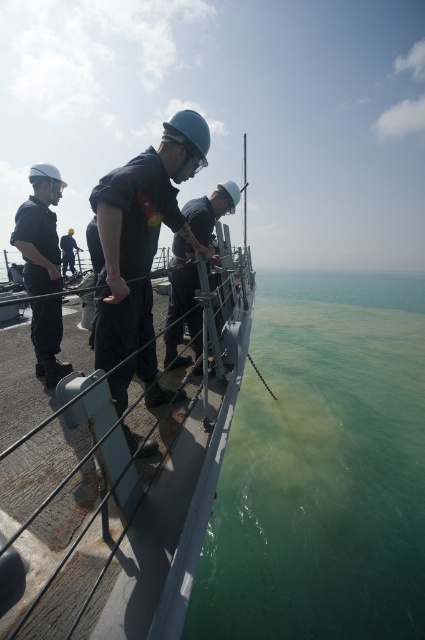
Does metallic gray helmet at center have a lesser height compared to dark blue uniform at center?

In fact, metallic gray helmet at center may be taller than dark blue uniform at center.

Describe the element at coordinates (184, 291) in the screenshot. This screenshot has height=640, width=425. I see `metallic gray helmet at center` at that location.

Is point (198, 317) positioned in front of point (64, 252)?

Yes, point (198, 317) is in front of point (64, 252).

Where is `metallic gray helmet at center`? This screenshot has height=640, width=425. metallic gray helmet at center is located at coordinates (184, 291).

Does black matte helmet at center have a greater height compared to matte black uniform at left?

In fact, black matte helmet at center may be shorter than matte black uniform at left.

This screenshot has width=425, height=640. I want to click on black matte helmet at center, so click(141, 250).

Does point (115, 336) come behind point (51, 262)?

No, it is in front of (51, 262).

At what (x,y) coordinates should I click in order to perform the action: click on black matte helmet at center. Please return your answer as a coordinate pair (x, y). The width and height of the screenshot is (425, 640). Looking at the image, I should click on (141, 250).

Who is taller, metallic gray boat at center or dark blue uniform at center?

With more height is dark blue uniform at center.

Consider the image. Is metallic gray boat at center to the left of dark blue uniform at center from the viewer's perspective?

In fact, metallic gray boat at center is to the right of dark blue uniform at center.

Describe the element at coordinates (121, 436) in the screenshot. I see `metallic gray boat at center` at that location.

Where is `metallic gray boat at center`? This screenshot has width=425, height=640. metallic gray boat at center is located at coordinates (121, 436).